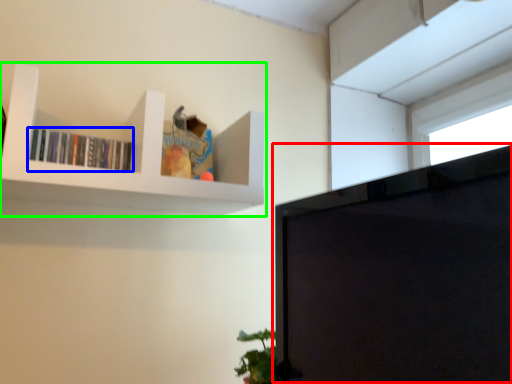
Question: Based on their relative distances, which object is nearer to computer monitor (highlighted by a red box)? Choose from book (highlighted by a blue box) and shelf (highlighted by a green box).

Choices:
 (A) book
 (B) shelf

Answer: (B)